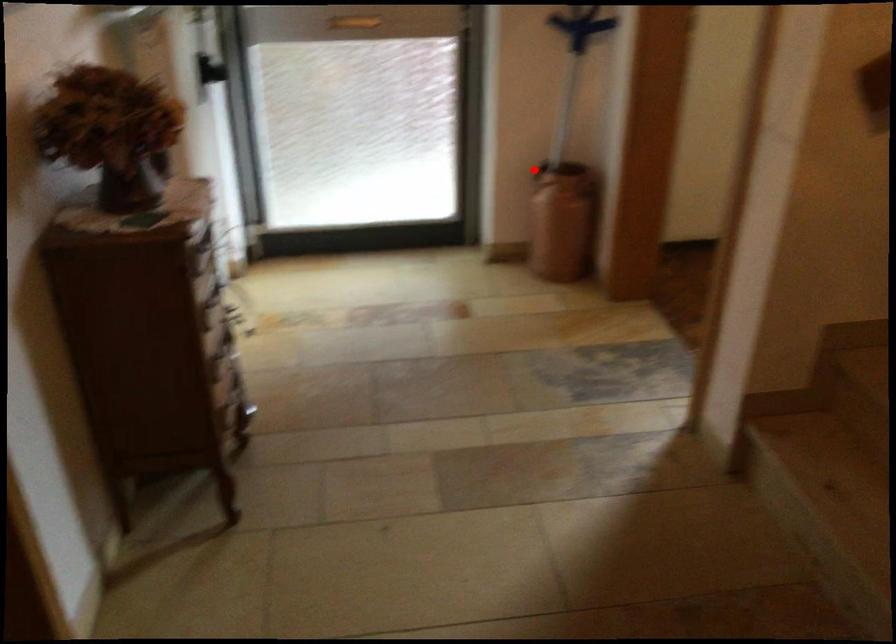
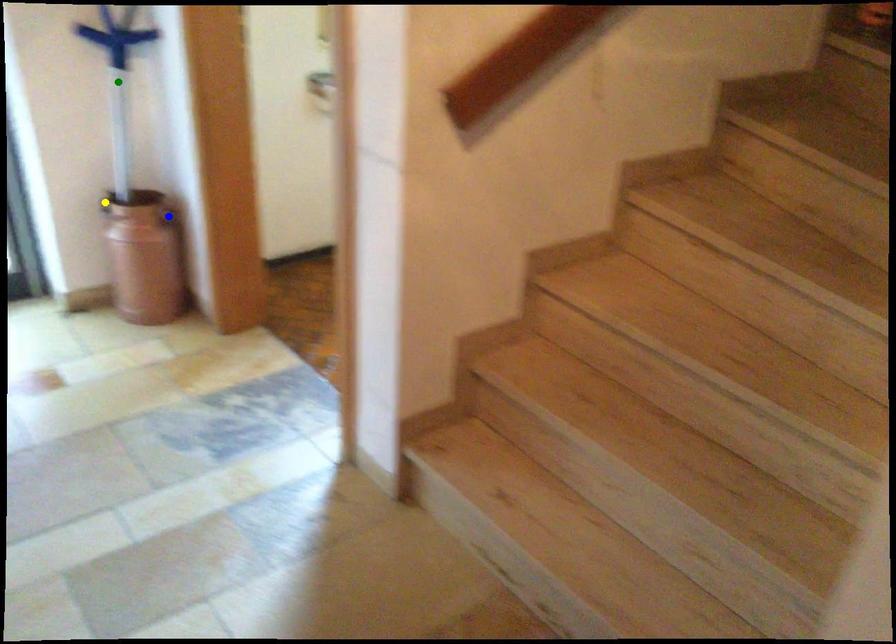
Question: I am providing you with two images of the same scene from different viewpoints. A red point is marked on the first image. You are given multiple points on the second image. Which point in image 2 is actually the same real-world point as the red point in image 1?

Choices:
 (A) green point
 (B) yellow point
 (C) blue point

Answer: (B)